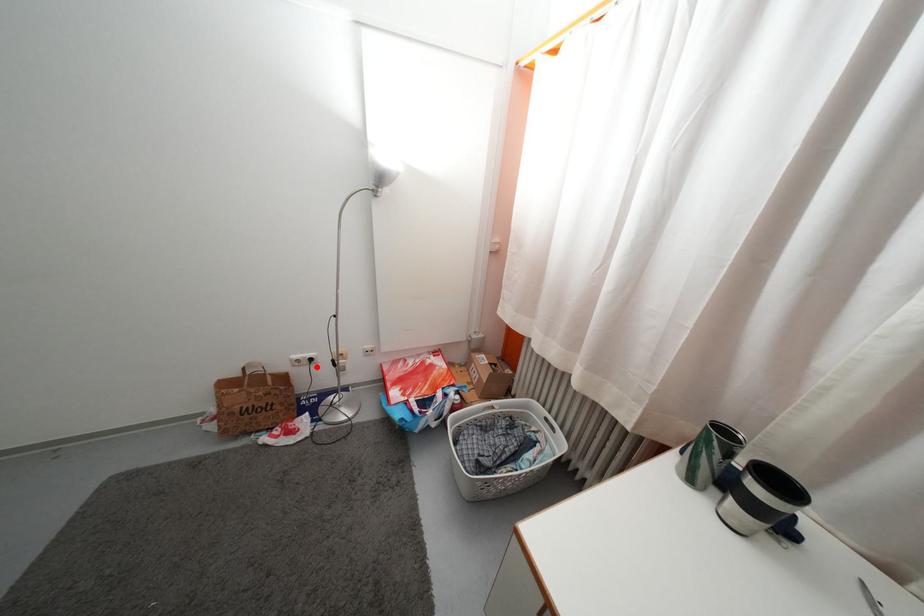
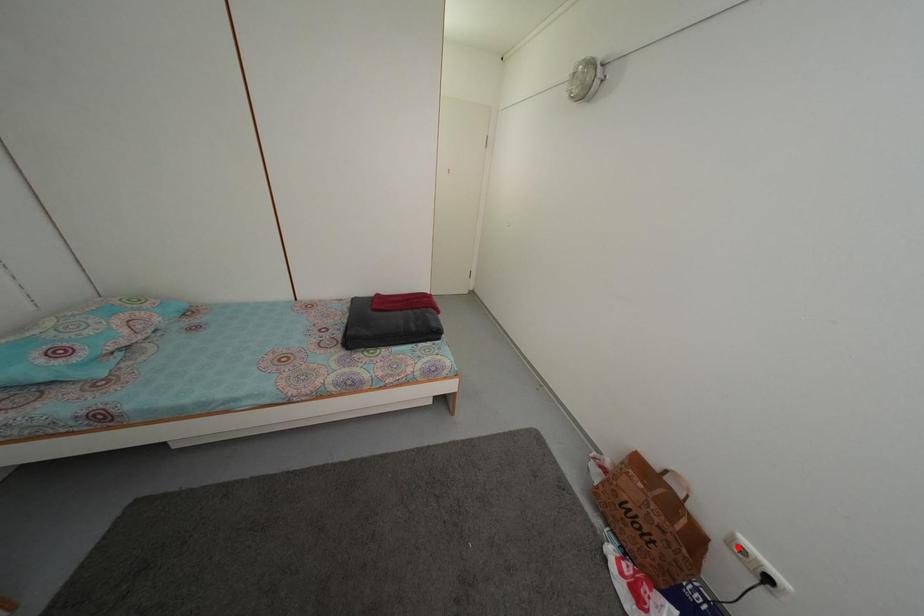
I am providing you with two images of the same scene from different viewpoints. A red point is marked on the first image and another point is marked on the second image. Is the marked point in image1 the same physical position as the marked point in image2?

No